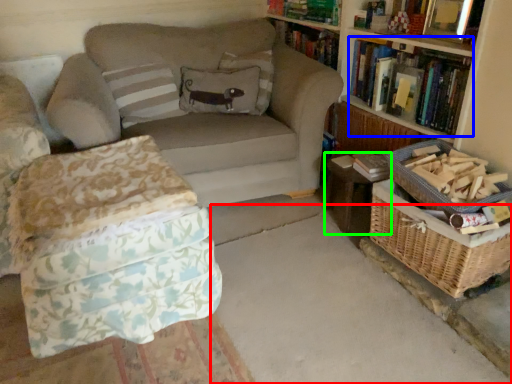
Question: Considering the real-world distances, which object is farthest from concrete (highlighted by a red box)? book (highlighted by a blue box) or table (highlighted by a green box)?

Choices:
 (A) book
 (B) table

Answer: (A)